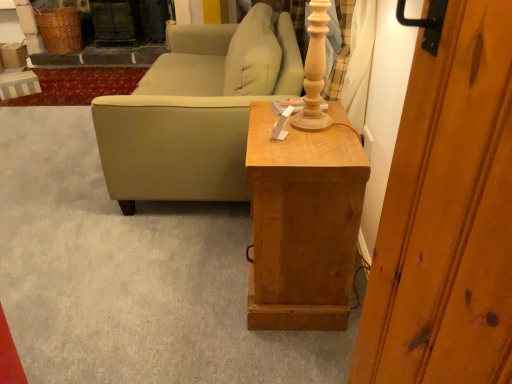
In order to click on free space in front of beige fabric couch at center in this screenshot , I will do `click(133, 270)`.